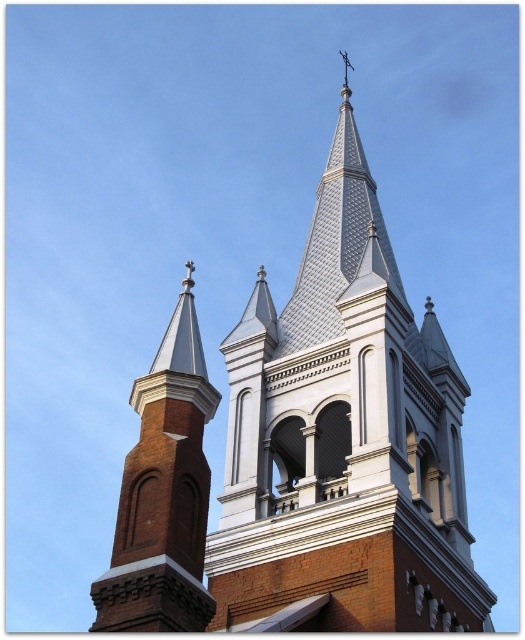
The width and height of the screenshot is (525, 640). Identify the location of white textured steeple at center. (303, 452).

Who is positioned more to the right, white textured steeple at center or red brick tower at left?

From the viewer's perspective, white textured steeple at center appears more on the right side.

Does point (429, 467) come farther from viewer compared to point (141, 460)?

Yes, it is.

Identify the location of white textured steeple at center. (303, 452).